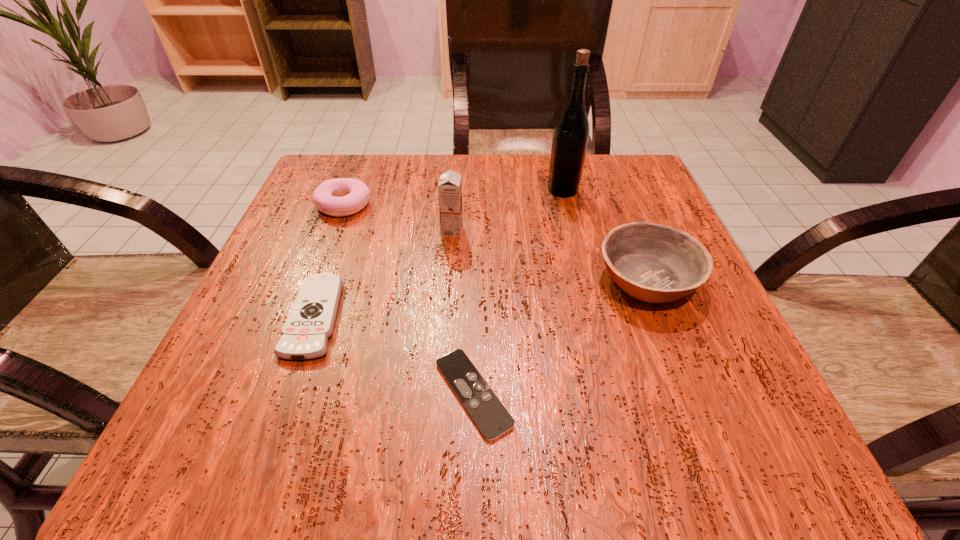
Where is `the third closest object to the fourth nearest object`? This screenshot has height=540, width=960. the third closest object to the fourth nearest object is located at coordinates (570, 139).

Locate an element on the screen. vacant space that satisfies the following two spatial constraints: 1. on the front side of the chocolate milk; 2. on the left side of the bowl is located at coordinates (448, 280).